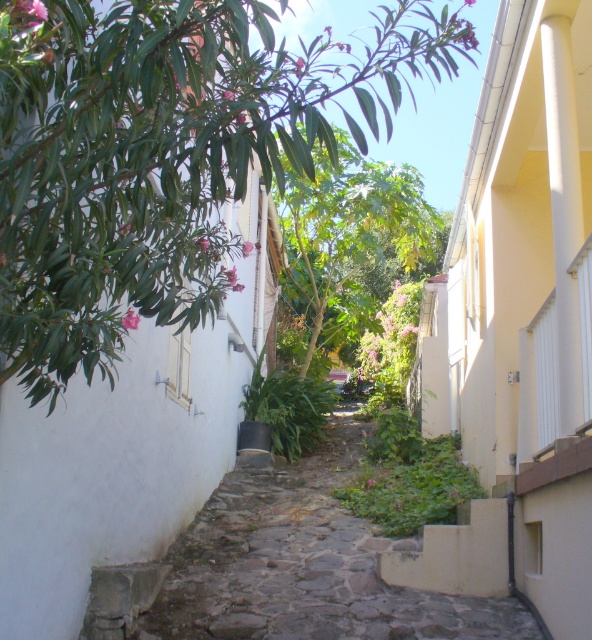
Can you confirm if green leafy tree at upper left is positioned above stone cobblestone path at center?

Indeed, green leafy tree at upper left is positioned over stone cobblestone path at center.

Locate an element on the screen. The image size is (592, 640). green leafy tree at upper left is located at coordinates (163, 154).

Who is more distant from viewer, (143,204) or (337,236)?

Point (337,236)

You are a GUI agent. You are given a task and a screenshot of the screen. Output one action in this format:
    pyautogui.click(x=<x>, y=<y>)
    Task: Click on the green leafy tree at upper left
    
    Given the screenshot: What is the action you would take?
    pyautogui.click(x=163, y=154)

You are a GUI agent. You are given a task and a screenshot of the screen. Output one action in this format:
    pyautogui.click(x=<x>, y=<y>)
    Task: Click on the green leafy tree at upper left
    The height and width of the screenshot is (640, 592).
    Given the screenshot: What is the action you would take?
    pyautogui.click(x=163, y=154)

Where is `stone cobblestone path at center`? stone cobblestone path at center is located at coordinates (287, 566).

Find the location of a particular element. This screenshot has height=640, width=592. stone cobblestone path at center is located at coordinates (287, 566).